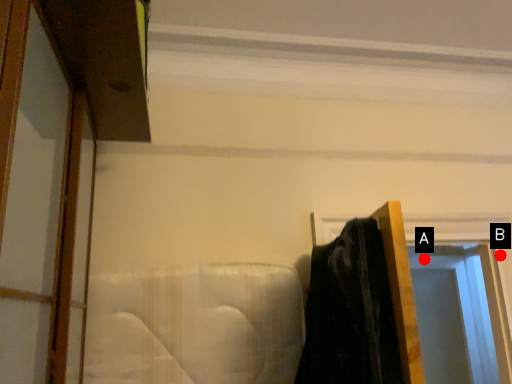
Question: Two points are circled on the image, labeled by A and B beside each circle. Which of the following is the farthest from the observer?

Choices:
 (A) A is further
 (B) B is further

Answer: (A)